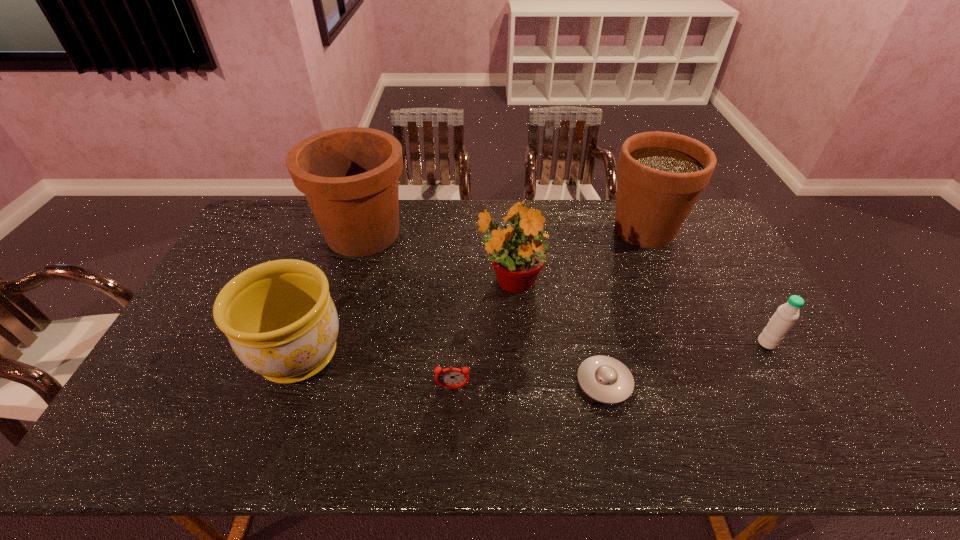
What are the coordinates of `free space located 0.270m on the left of the rightmost flowerpot` in the screenshot? It's located at (x=530, y=230).

Where is `free region located 0.050m on the back of the third flowerpot from left to right`? The image size is (960, 540). free region located 0.050m on the back of the third flowerpot from left to right is located at coordinates (507, 246).

This screenshot has height=540, width=960. What are the coordinates of `vacant space positioned on the right of the fourth shortest object` in the screenshot? It's located at (482, 355).

The height and width of the screenshot is (540, 960). I want to click on vacant space positioned 0.050m on the front of the fifth tallest object, so click(780, 366).

Find the location of a particular element. vacant area situated 0.140m on the front-facing side of the alarm clock is located at coordinates (450, 444).

I want to click on vacant space located on the right of the saucer, so pos(782,382).

Image resolution: width=960 pixels, height=540 pixels. I want to click on flowerpot at the right edge, so click(661, 175).

Locate an element on the screen. The height and width of the screenshot is (540, 960). water bottle situated at the right edge is located at coordinates (783, 319).

At what (x,y) coordinates should I click in order to perform the action: click on object that is at the far right corner. Please return your answer as a coordinate pair (x, y). Looking at the image, I should click on (661, 175).

The height and width of the screenshot is (540, 960). I want to click on vacant space at the near edge of the desktop, so 246,442.